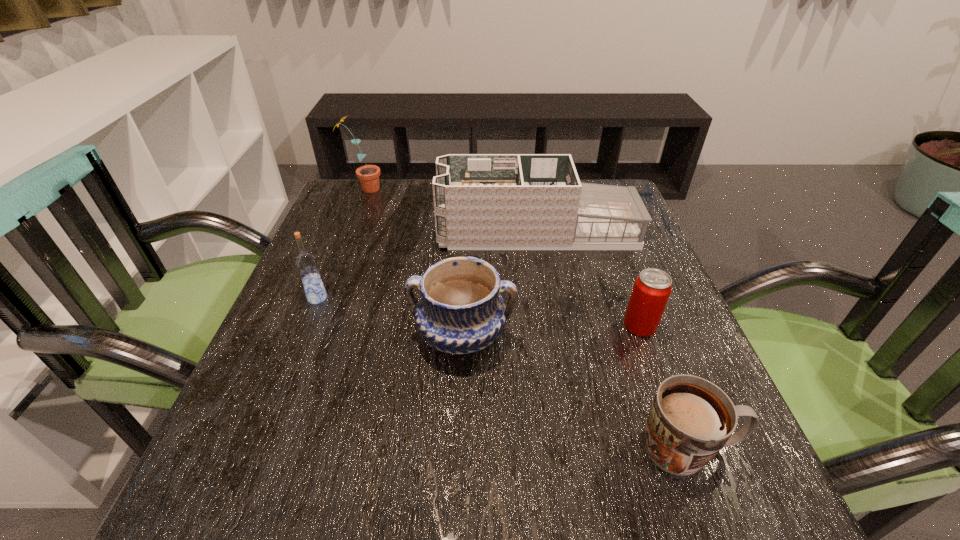
This screenshot has height=540, width=960. What are the coordinates of `blank region between the vodka and the pottery` in the screenshot? It's located at (390, 317).

Where is `free spot between the dollhouse and the can`? free spot between the dollhouse and the can is located at coordinates (588, 279).

Identify the location of free space between the second farthest object and the can. (588, 279).

You are a GUI agent. You are given a task and a screenshot of the screen. Output one action in this format:
    pyautogui.click(x=<x>, y=<y>)
    Task: Click on the free space between the mug and the vodka
    
    Given the screenshot: What is the action you would take?
    pyautogui.click(x=503, y=373)

Locate an element on the screen. The height and width of the screenshot is (540, 960). vacant area that lies between the pottery and the mug is located at coordinates (575, 392).

Find the location of a particular element. This screenshot has width=960, height=540. unoccupied area between the nearest object and the tallest object is located at coordinates (526, 319).

In order to click on unoccupied position between the pottery and the sunflower in this screenshot , I will do `click(413, 262)`.

Select which object is the third closest to the pottery. Please provide its 2D coordinates. Your answer should be formatted as a tuple, i.e. [(x, y)], where the tuple contains the x and y coordinates of a point satisfying the conditions above.

[(690, 420)]

Where is `object that stands as the closest to the fifth nearest object`? object that stands as the closest to the fifth nearest object is located at coordinates (461, 311).

The width and height of the screenshot is (960, 540). Identify the location of vacant space that satisfies the following two spatial constraints: 1. at the entrance of the can; 2. on the left side of the second farthest object. (553, 326).